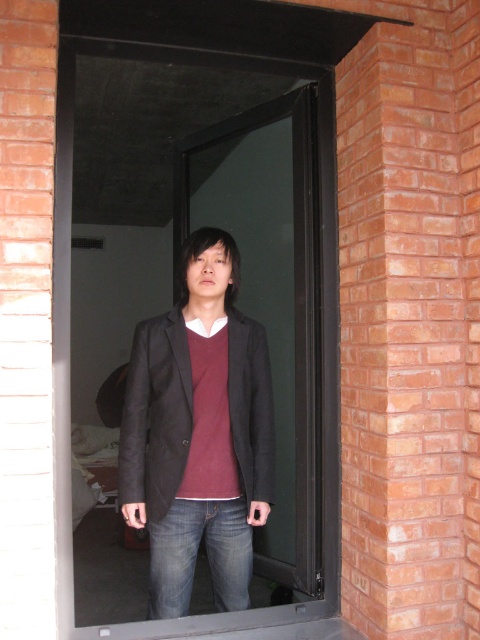
Is point (122, 308) positioned behind point (252, 433)?

Yes.

Based on the photo, does transparent glass door at center appear over matte black blazer at center?

Indeed, transparent glass door at center is positioned over matte black blazer at center.

This screenshot has width=480, height=640. What do you see at coordinates (182, 321) in the screenshot? I see `transparent glass door at center` at bounding box center [182, 321].

Where is `transparent glass door at center`? transparent glass door at center is located at coordinates (182, 321).